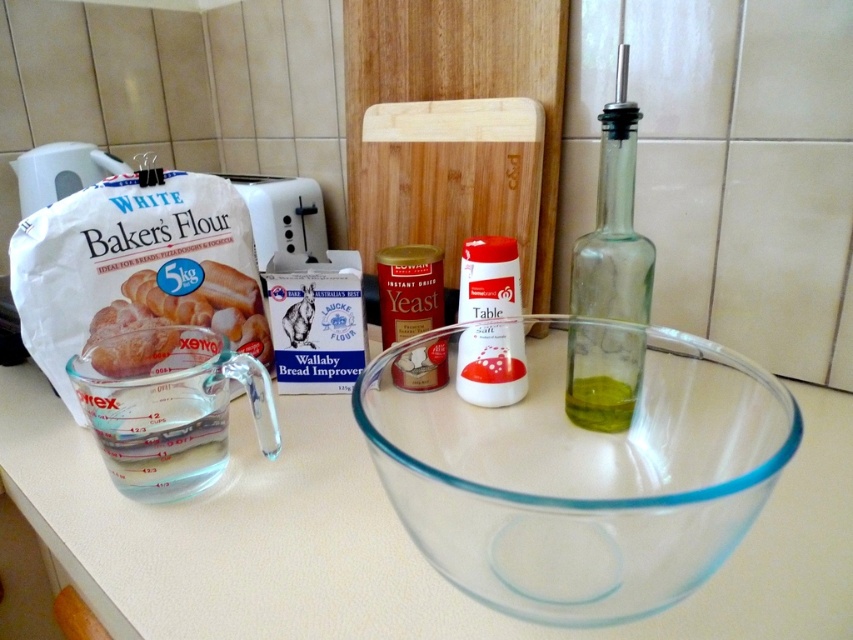
Is transparent glass bowl at center wider than green glass bottle at right?

Yes.

Who is positioned more to the left, transparent glass bowl at center or green glass bottle at right?

transparent glass bowl at center

Which is in front, point (728, 376) or point (614, 356)?

Positioned in front is point (728, 376).

In order to click on transparent glass bowl at center in this screenshot , I will do `click(575, 465)`.

Between green glass bottle at right and white matte bakers flour at left, which one has more height?

green glass bottle at right

You are a GUI agent. You are given a task and a screenshot of the screen. Output one action in this format:
    pyautogui.click(x=<x>, y=<y>)
    Task: Click on the green glass bottle at right
    
    Given the screenshot: What is the action you would take?
    pyautogui.click(x=614, y=224)

Which is behind, point (572, 326) or point (122, 340)?

Positioned behind is point (122, 340).

Identify the location of green glass bottle at right. The image size is (853, 640). (614, 224).

Between point (724, 488) and point (149, 284), which one is positioned in front?

Point (724, 488)

Locate an element on the screen. The image size is (853, 640). transparent glass bowl at center is located at coordinates (575, 465).